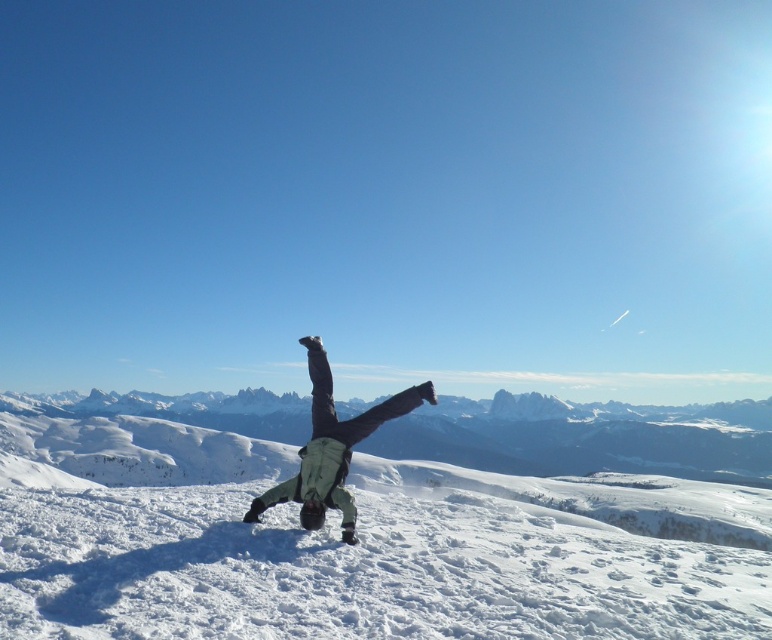
You are taking a photo of the snowy mountain at center. Where should you point your camera to capture it in the frame?

You should point your camera towards the coordinates point at (584, 436) to capture the snowy mountain at center.

You are a photographer trying to capture the person doing a handstand. You notice the white powdery snow at center and the light green fabric pants at center. Which object is closer to the camera? Please explain your reasoning based on their positions.

The white powdery snow at center is closer to the camera because it is positioned in front of the light green fabric pants at center, meaning the snow appears in the foreground while the pants are slightly behind.